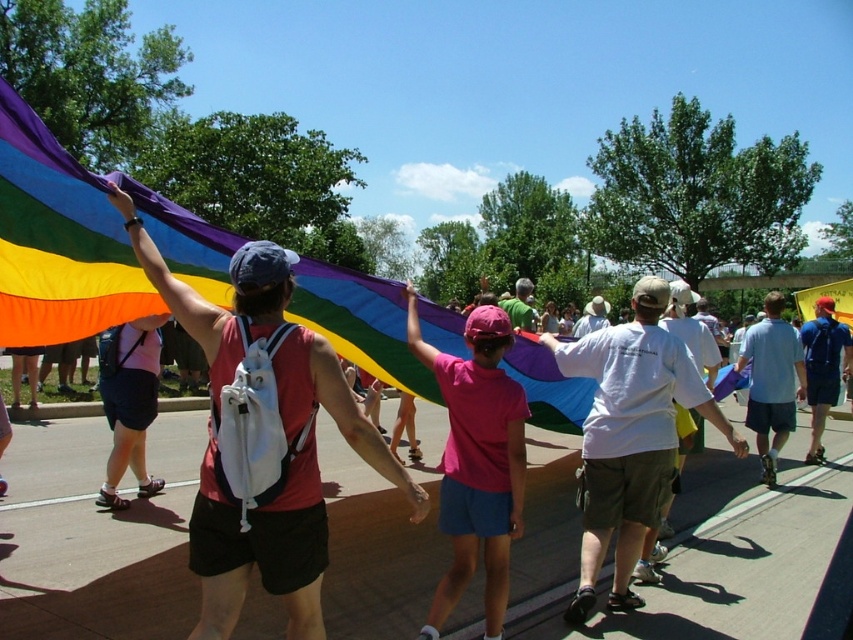
Question: Among these objects, which one is nearest to the camera?

Choices:
 (A) light blue shirt at center
 (B) blue backpack at center
 (C) pink fabric shirt at center
 (D) rainbow fabric flag at upper left

Answer: (C)

Question: Among these points, which one is nearest to the camera?

Choices:
 (A) (641, 497)
 (B) (515, 314)
 (C) (358, 275)
 (D) (752, 408)

Answer: (A)

Question: Does white cotton t-shirt at center have a larger size compared to blue backpack at center?

Choices:
 (A) yes
 (B) no

Answer: (B)

Question: Is pink fabric shirt at center below light blue shirt at center?

Choices:
 (A) no
 (B) yes

Answer: (A)

Question: Which object is closer to the camera taking this photo?

Choices:
 (A) light blue shirt at center
 (B) blue backpack at center
 (C) green t-shirt at center

Answer: (C)

Question: Does pink fabric shirt at center lie behind green t-shirt at center?

Choices:
 (A) no
 (B) yes

Answer: (A)